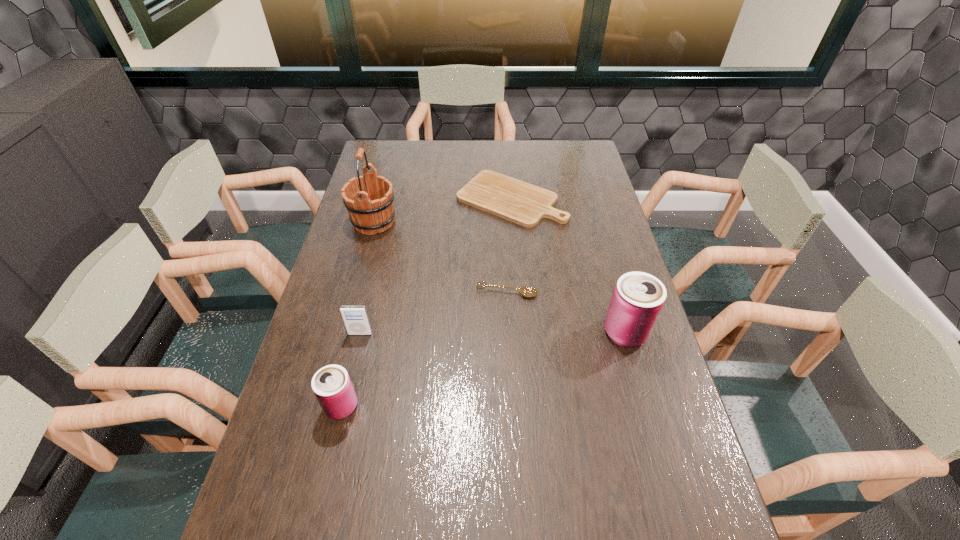
Find the location of a particular element. the nearer can is located at coordinates (332, 386).

Find the location of `the shorter can`. the shorter can is located at coordinates (332, 386).

Identify the location of the rightmost object. The image size is (960, 540). (638, 298).

Identify the location of the fifth shortest object. Image resolution: width=960 pixels, height=540 pixels. (638, 298).

Find the location of `the shortest object`. the shortest object is located at coordinates (519, 202).

The width and height of the screenshot is (960, 540). I want to click on the tallest object, so click(x=373, y=212).

Locate an element on the screen. The height and width of the screenshot is (540, 960). iPod is located at coordinates (355, 318).

The width and height of the screenshot is (960, 540). I want to click on the fifth tallest object, so click(525, 291).

At what (x,y) coordinates should I click in order to perform the action: click on the fourth nearest object. Please return your answer as a coordinate pair (x, y). Image resolution: width=960 pixels, height=540 pixels. Looking at the image, I should click on (525, 291).

Find the location of a particular element. The height and width of the screenshot is (540, 960). vacant region located on the right of the nearest object is located at coordinates (400, 406).